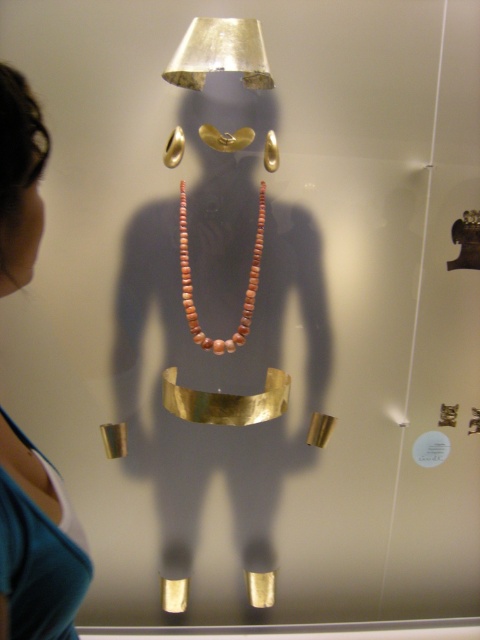
You are a fashion designer looking at the image of a mannequin wearing a teal fabric top at left. You need to place a new accessory at point (36,545). Where exactly would that be?

The point (36,545) is on the teal fabric top at left, so you should place the accessory there.

You are an archaeologist examining the ancient display. You need to determine which object is bigger between the teal fabric top at left and the matte coral necklace at center. Which one is larger?

The teal fabric top at left has a larger size compared to the matte coral necklace at center, so the teal fabric top at left is larger.

Based on the photo, you are an art curator examining the display. You notice the teal fabric top at left. Where is it located in the display?

The teal fabric top at left is located at the 2D coordinates point (36, 545) in the display.